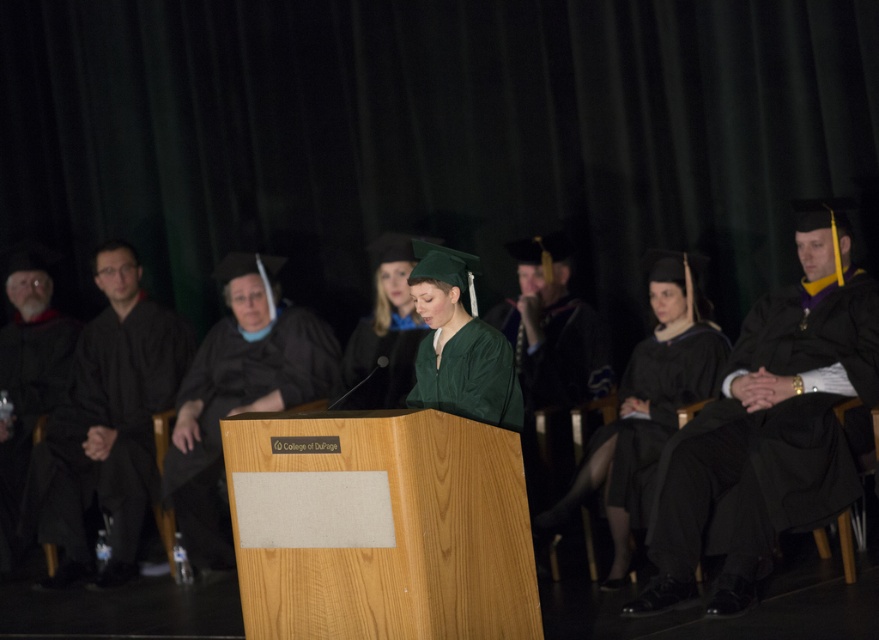
You are a photographer at the graduation ceremony. You need to capture a photo that includes both the black matte graduation gown at left and the black matte graduation gown at center. Based on their positions, which gown will appear closer to the bottom edge of the photo?

The black matte graduation gown at left will appear closer to the bottom edge of the photo because it is positioned below the black matte graduation gown at center.

You are a photographer at the College ofode ceremony. You need to capture a photo of the matte black graduation gown at center and the matte black gown at center. However, one of them is blocking the other. Which one should you ask to move so that both are visible in the photo?

The matte black graduation gown at center is taller than the matte black gown at center. Therefore, you should ask the taller matte black graduation gown at center to move so that both can be visible in the photo.